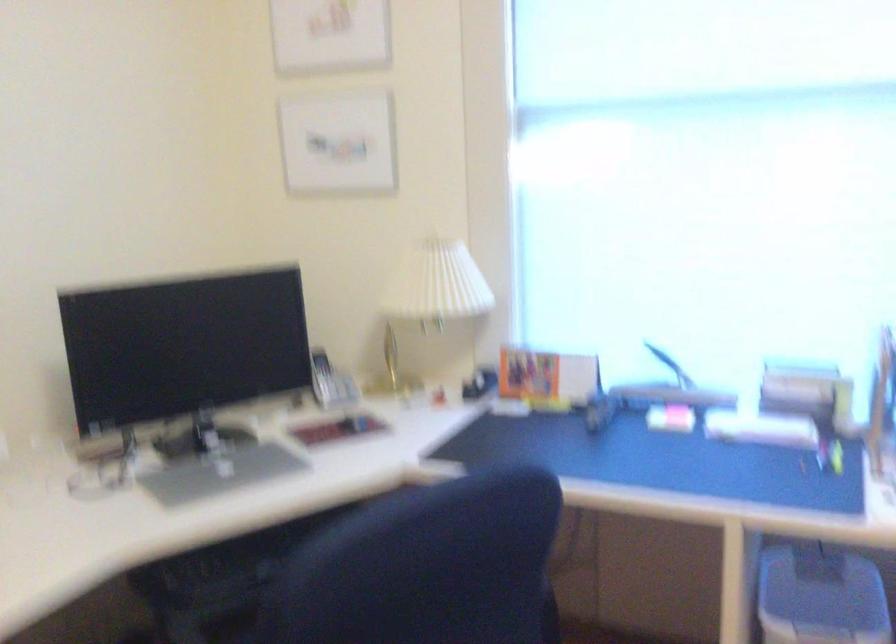
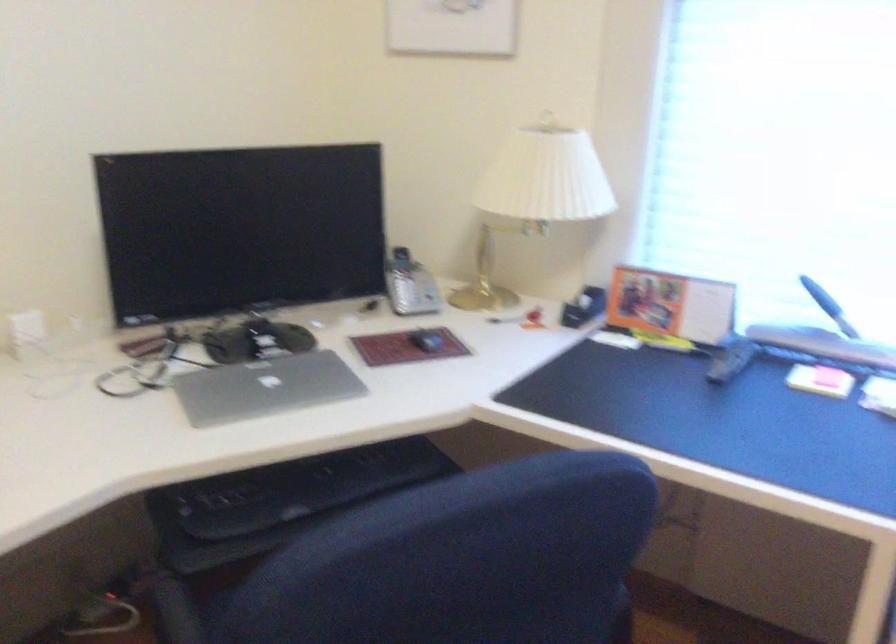
The point at (321, 379) is marked in the first image. Where is the corresponding point in the second image?

(401, 281)